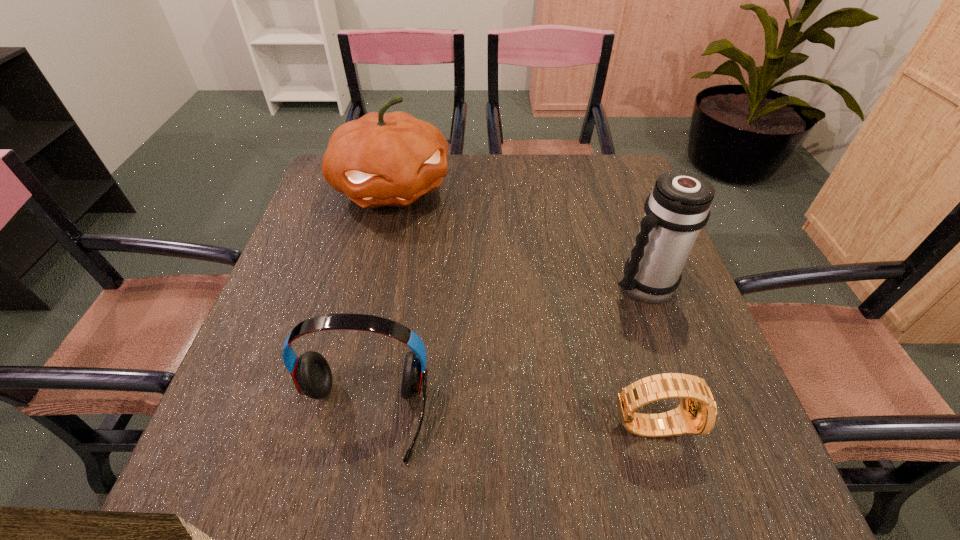
This screenshot has height=540, width=960. In order to click on vacant space that's between the third tallest object and the thermos bottle in this screenshot , I will do `click(503, 350)`.

Image resolution: width=960 pixels, height=540 pixels. What are the coordinates of `empty location between the third nearest object and the farthest object` in the screenshot? It's located at (517, 237).

At what (x,y) coordinates should I click in order to perform the action: click on empty space between the headset and the pumpkin. Please return your answer as a coordinate pair (x, y). The image size is (960, 540). Looking at the image, I should click on (377, 302).

Identify the location of empty space that is in between the thermos bottle and the watch. Image resolution: width=960 pixels, height=540 pixels. (647, 355).

This screenshot has width=960, height=540. I want to click on vacant area that lies between the third nearest object and the watch, so click(647, 355).

Where is `the second closest object to the thermos bottle`? This screenshot has height=540, width=960. the second closest object to the thermos bottle is located at coordinates (382, 159).

Locate an element on the screen. This screenshot has width=960, height=540. object that ranks as the closest to the pumpkin is located at coordinates (678, 207).

Identify the location of free location that satisfies the following two spatial constraints: 1. on the front side of the farthest object; 2. on the left side of the third nearest object. (369, 286).

You are a GUI agent. You are given a task and a screenshot of the screen. Output one action in this format:
    pyautogui.click(x=<x>, y=<y>)
    Task: Click on the vacant position in the image that satisfies the following two spatial constraints: 1. with the microphone attached to the side of the shortest object; 2. on the face of the headset
    This screenshot has height=540, width=960.
    Given the screenshot: What is the action you would take?
    pyautogui.click(x=361, y=424)

The image size is (960, 540). I want to click on blank area in the image that satisfies the following two spatial constraints: 1. with the microphone attached to the side of the second shortest object; 2. on the face of the shortest object, so click(361, 424).